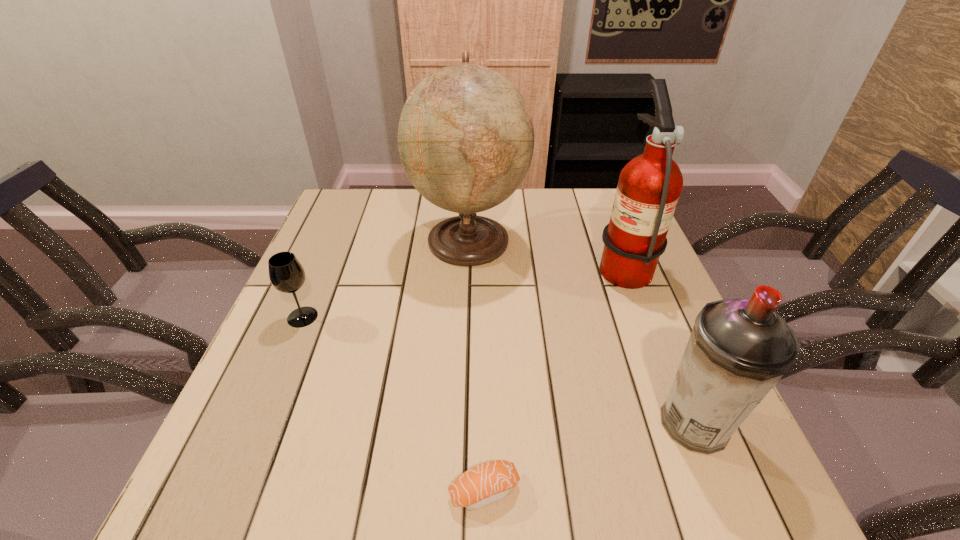
The height and width of the screenshot is (540, 960). In order to click on globe in this screenshot , I will do `click(465, 137)`.

Find the location of a particular element. This screenshot has width=960, height=540. fire extinguisher is located at coordinates (649, 186).

Locate an element on the screen. The width and height of the screenshot is (960, 540). the third tallest object is located at coordinates (738, 349).

The width and height of the screenshot is (960, 540). In order to click on aerosol can in this screenshot , I will do pos(738,349).

You are a GUI agent. You are given a task and a screenshot of the screen. Output one action in this format:
    pyautogui.click(x=<x>, y=<y>)
    Task: Click on the leftmost object
    This screenshot has width=960, height=540.
    Given the screenshot: What is the action you would take?
    pyautogui.click(x=287, y=275)

What are the coordinates of `wineglass` in the screenshot? It's located at (287, 275).

At what (x,y) coordinates should I click in order to perform the action: click on the nearest object. Please return your answer as a coordinate pair (x, y). Looking at the image, I should click on (489, 482).

I want to click on sushi, so click(489, 482).

Image resolution: width=960 pixels, height=540 pixels. Find the location of `free location located 0.270m on the front-facing side of the globe`. free location located 0.270m on the front-facing side of the globe is located at coordinates (622, 240).

Image resolution: width=960 pixels, height=540 pixels. I want to click on vacant space situated on the nozzle and handle of the fire extinguisher, so click(x=465, y=264).